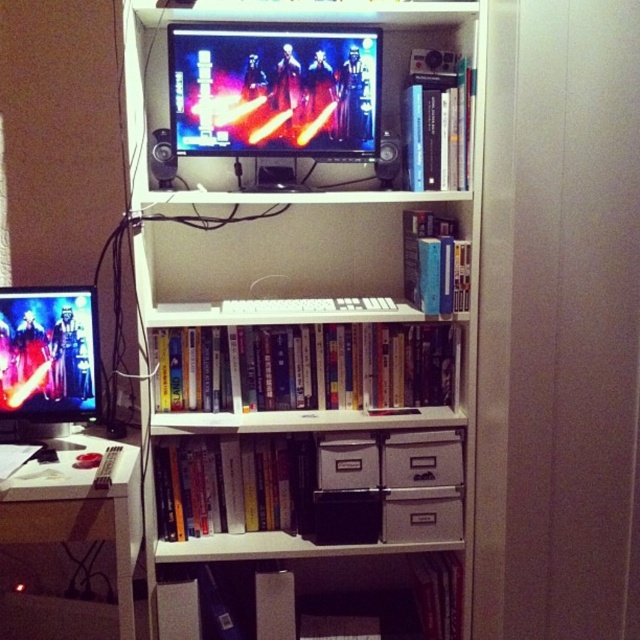
What are the coordinates of the matte black monitor at left?

The coordinates of the matte black monitor at left are at point (48, 358).

You are standing 1.97 meters away from the point at coordinates (x=432, y=531). If you want to see the entire bookshelf, will you be able to see the TV on the top shelf?

Yes, because the point at coordinates (x=432, y=531) is 1.97 meters away from you, and the TV is located on the top shelf of the bookshelf, so you can see it from that distance.

You are organizing items on the bookshelf and need to place a new item between the white cardboard drawer at lower center and the matte black speaker at upper center. Is there enough vertical space between them to fit a standard 15cm tall object?

The white cardboard drawer at lower center is below the matte black speaker at upper center, so there is vertical space between them. A standard 15cm tall object can fit between them as long as the distance between the two items is at least 15cm.